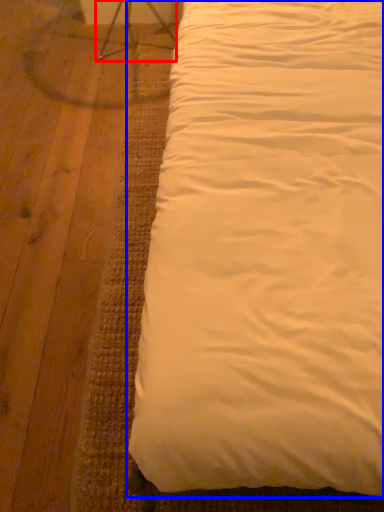
Question: Which of the following is the closest to the observer, swivel chair (highlighted by a red box) or bed (highlighted by a blue box)?

Choices:
 (A) swivel chair
 (B) bed

Answer: (B)